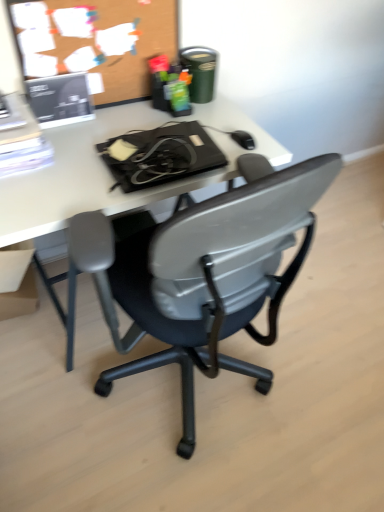
I want to click on free spot in front of white plastic desk at center, so click(142, 426).